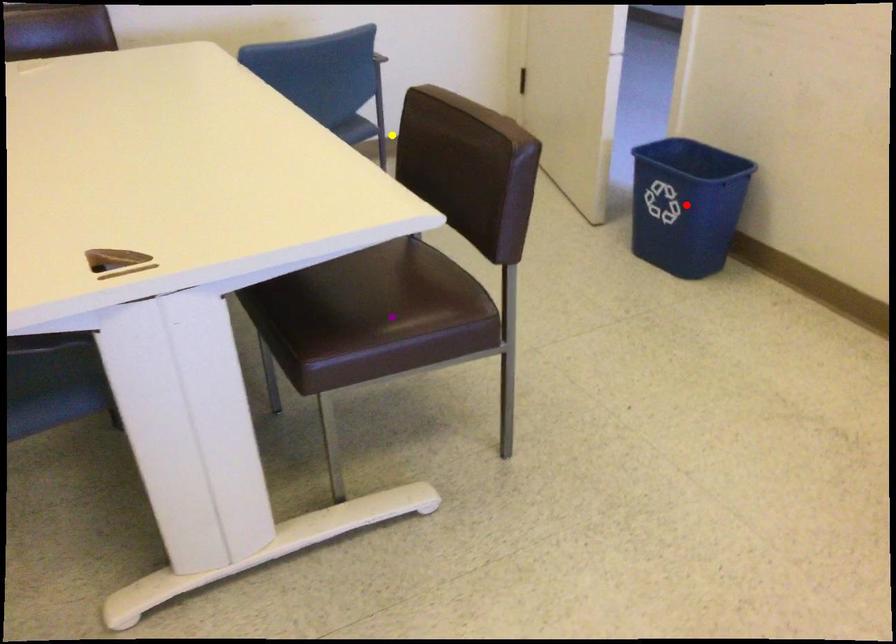
Looking at this image, order these from nearest to farthest:
yellow point | purple point | red point

red point
yellow point
purple point